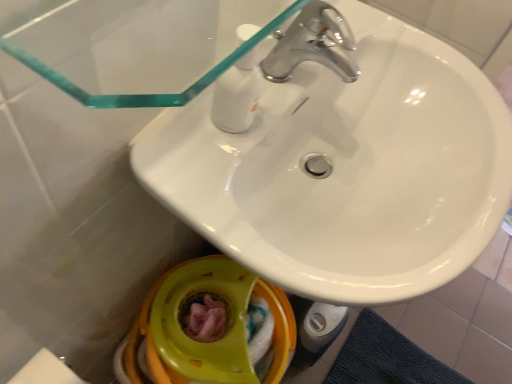
Locate an element on the screen. vacant space in front of chrome metallic faucet at upper center, which is the first tap from bottom to top is located at coordinates (214, 148).